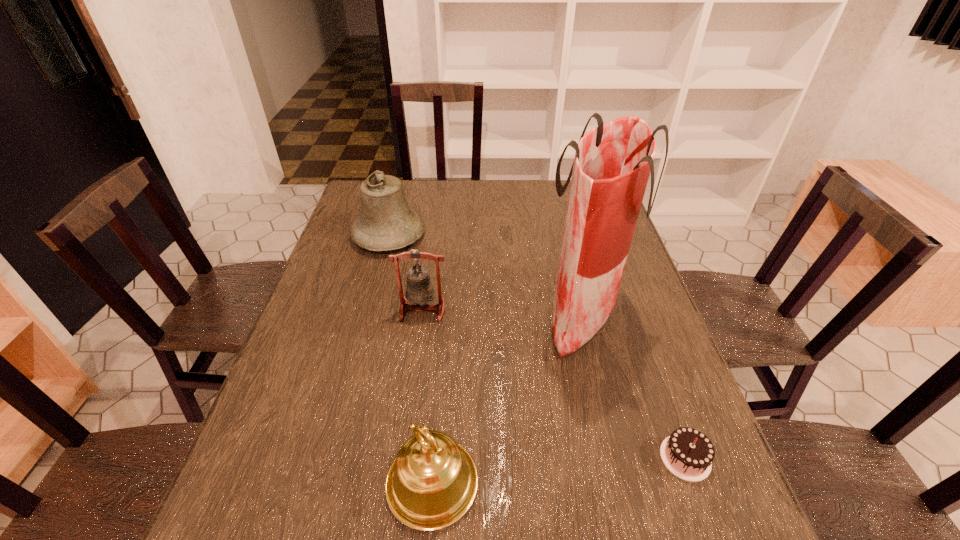
You are a GUI agent. You are given a task and a screenshot of the screen. Output one action in this format:
    pyautogui.click(x=<x>, y=<y>)
    Task: Click on the vacant space that's between the farthest object and the nearest bell
    The height and width of the screenshot is (540, 960).
    Given the screenshot: What is the action you would take?
    pyautogui.click(x=411, y=360)

Locate an element on the screen. This screenshot has height=540, width=960. vacant space in between the tallest object and the chocolate cake is located at coordinates (634, 387).

What are the coordinates of `free spot between the nearest bell and the second farthest bell` in the screenshot? It's located at (427, 397).

The width and height of the screenshot is (960, 540). What are the coordinates of `free point between the shortest object and the second nearest bell` in the screenshot? It's located at (554, 384).

This screenshot has width=960, height=540. Identify the location of free space between the shortest object and the second nearest bell. (554, 384).

The height and width of the screenshot is (540, 960). I want to click on vacant point located between the chocolate cake and the nearest bell, so click(x=559, y=470).

The image size is (960, 540). Identify the location of free area in between the farthest bell and the nearest bell. (411, 360).

Locate an element on the screen. the fourth closest object relative to the farthest object is located at coordinates (687, 453).

Choose which object is the fourth nearest neighbor to the second farthest bell. Please provide its 2D coordinates. Your answer should be formatted as a tuple, i.e. [(x, y)], where the tuple contains the x and y coordinates of a point satisfying the conditions above.

[(687, 453)]

Where is `bell object that ranks as the closest to the second nearest bell`? bell object that ranks as the closest to the second nearest bell is located at coordinates (386, 222).